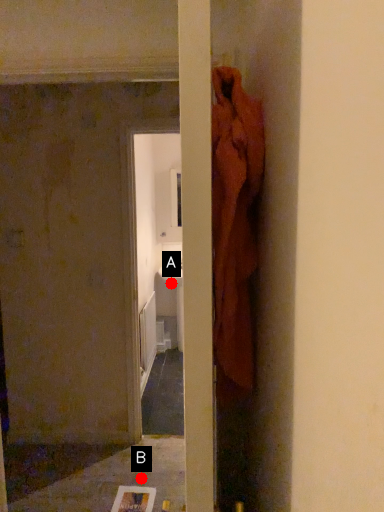
Question: Two points are circled on the image, labeled by A and B beside each circle. Which point appears closest to the camera in this image?

Choices:
 (A) A is closer
 (B) B is closer

Answer: (B)